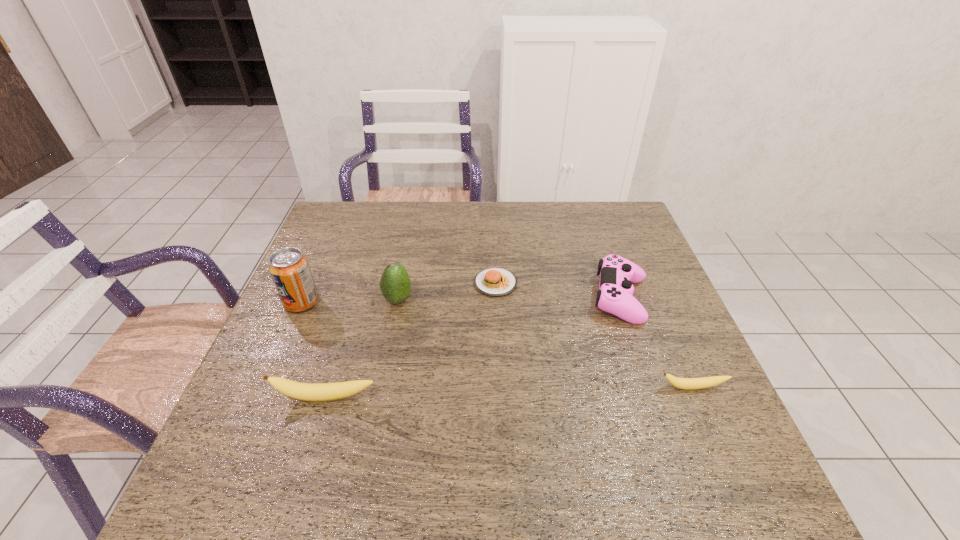
Locate an element on the screen. This screenshot has height=540, width=960. free space located 0.370m on the back of the shortest object is located at coordinates (492, 202).

Find the location of a particular element. Image resolution: width=960 pixels, height=540 pixels. vacant region located on the left of the control is located at coordinates (471, 298).

Identify the location of vacant space located 0.220m on the front of the tallest object. (265, 386).

What are the coordinates of `banana at the left edge` in the screenshot? It's located at (302, 391).

The width and height of the screenshot is (960, 540). Identify the location of soda can situated at the left edge. (290, 271).

Locate an element on the screen. banana that is at the right edge is located at coordinates (682, 383).

I want to click on control present at the right edge, so click(617, 274).

Identify the location of free space at the far edge. (574, 227).

Image resolution: width=960 pixels, height=540 pixels. In order to click on blank area at the near edge in this screenshot , I will do `click(593, 437)`.

Identify the location of free location at the left edge. This screenshot has height=540, width=960. (291, 326).